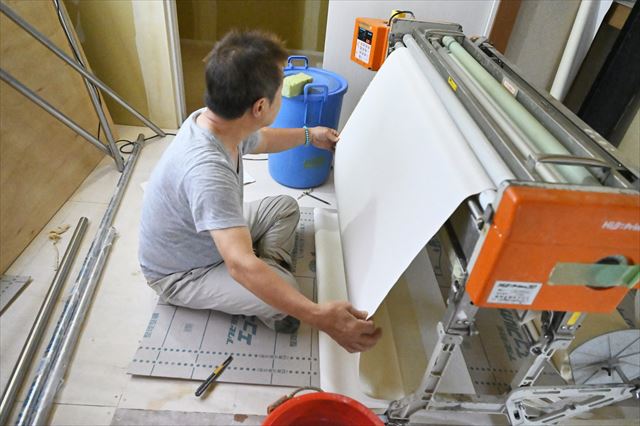
Locate an element on the screen. The width and height of the screenshot is (640, 426). wood panel is located at coordinates point(26,148).